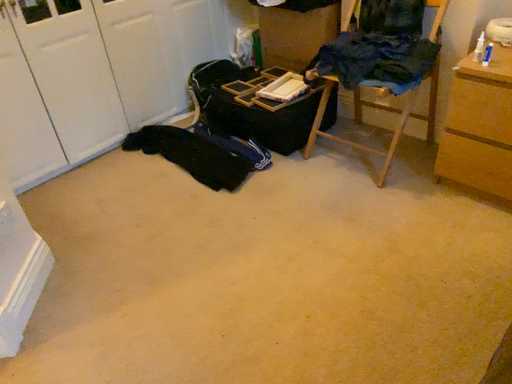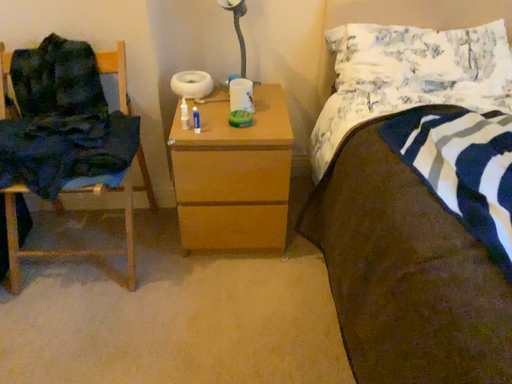
Question: How did the camera likely rotate when shooting the video?

Choices:
 (A) rotated downward
 (B) rotated upward

Answer: (B)